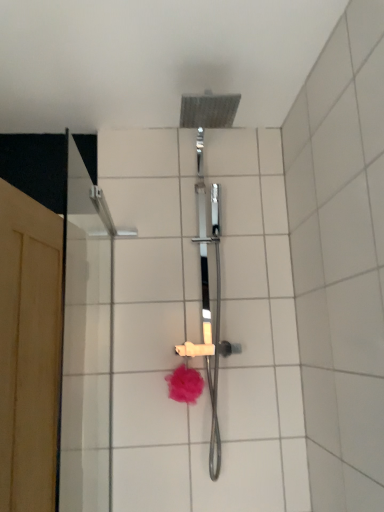
Question: From the image's perspective, is pink fluffy bath puff at center over white ceramic tile at upper center?

Choices:
 (A) no
 (B) yes

Answer: (A)

Question: Would you say pink fluffy bath puff at center contains white ceramic tile at upper center?

Choices:
 (A) yes
 (B) no

Answer: (B)

Question: From a real-world perspective, does pink fluffy bath puff at center stand above white ceramic tile at upper center?

Choices:
 (A) yes
 (B) no

Answer: (B)

Question: Is pink fluffy bath puff at center to the left of white ceramic tile at upper center from the viewer's perspective?

Choices:
 (A) yes
 (B) no

Answer: (A)

Question: Is pink fluffy bath puff at center not close to white ceramic tile at upper center?

Choices:
 (A) yes
 (B) no

Answer: (B)

Question: Considering the positions of wooden screen door at left and pink fluffy bath puff at center in the image, is wooden screen door at left wider or thinner than pink fluffy bath puff at center?

Choices:
 (A) thin
 (B) wide

Answer: (B)

Question: In terms of size, does wooden screen door at left appear bigger or smaller than pink fluffy bath puff at center?

Choices:
 (A) big
 (B) small

Answer: (A)

Question: Does point (39, 474) appear closer or farther from the camera than point (187, 371)?

Choices:
 (A) farther
 (B) closer

Answer: (B)

Question: In the image, is wooden screen door at left positioned in front of or behind pink fluffy bath puff at center?

Choices:
 (A) front
 (B) behind

Answer: (A)

Question: From the image's perspective, is white ceramic tile at upper center above or below wooden screen door at left?

Choices:
 (A) below
 (B) above

Answer: (B)

Question: Considering the positions of white ceramic tile at upper center and wooden screen door at left in the image, is white ceramic tile at upper center taller or shorter than wooden screen door at left?

Choices:
 (A) short
 (B) tall

Answer: (B)

Question: Is white ceramic tile at upper center inside or outside of wooden screen door at left?

Choices:
 (A) outside
 (B) inside

Answer: (A)

Question: Is white ceramic tile at upper center in front of or behind wooden screen door at left in the image?

Choices:
 (A) behind
 (B) front

Answer: (B)

Question: In terms of size, does pink fluffy bath puff at center appear bigger or smaller than white ceramic tile at upper center?

Choices:
 (A) big
 (B) small

Answer: (B)

Question: Considering the positions of point (188, 371) and point (327, 446), is point (188, 371) closer or farther from the camera than point (327, 446)?

Choices:
 (A) closer
 (B) farther

Answer: (B)